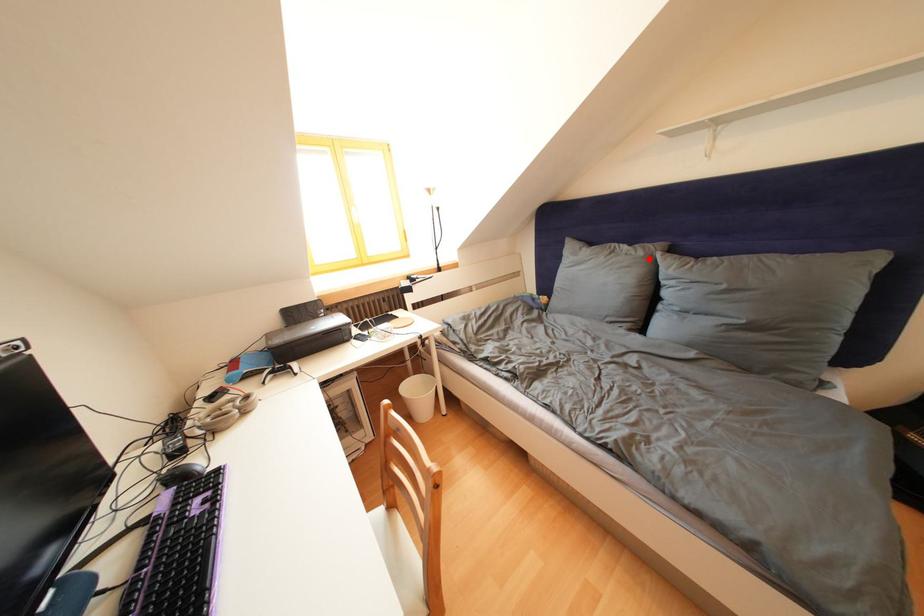
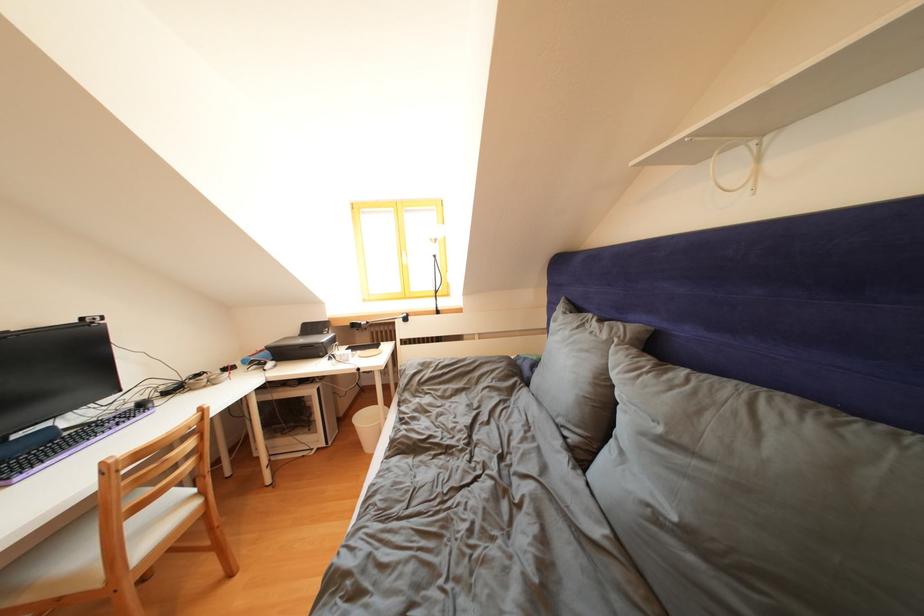
Where in the second image is the point corresponding to the highlighted location from the first image?

(612, 341)